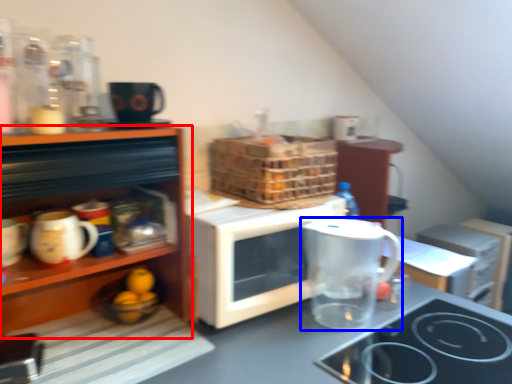
Question: Among these objects, which one is nearest to the camera, cabinetry (highlighted by a red box) or jug (highlighted by a blue box)?

Choices:
 (A) cabinetry
 (B) jug

Answer: (A)